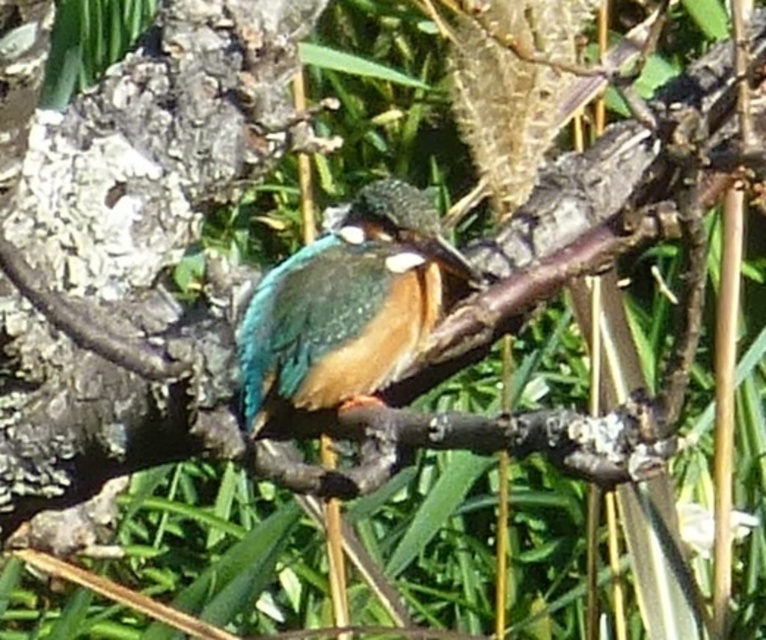
Question: Which object appears closest to the camera in this image?

Choices:
 (A) shiny blue-green bird at center
 (B) rough bark tree trunk at left

Answer: (B)

Question: Is rough bark tree trunk at left closer to camera compared to shiny blue-green bird at center?

Choices:
 (A) no
 (B) yes

Answer: (B)

Question: Which point appears closest to the camera in this image?

Choices:
 (A) (131, 122)
 (B) (372, 212)

Answer: (B)

Question: Is the position of rough bark tree trunk at left less distant than that of shiny blue-green bird at center?

Choices:
 (A) no
 (B) yes

Answer: (B)

Question: Which of the following is the closest to the observer?

Choices:
 (A) (319, 394)
 (B) (133, 106)

Answer: (A)

Question: Is rough bark tree trunk at left positioned behind shiny blue-green bird at center?

Choices:
 (A) yes
 (B) no

Answer: (B)